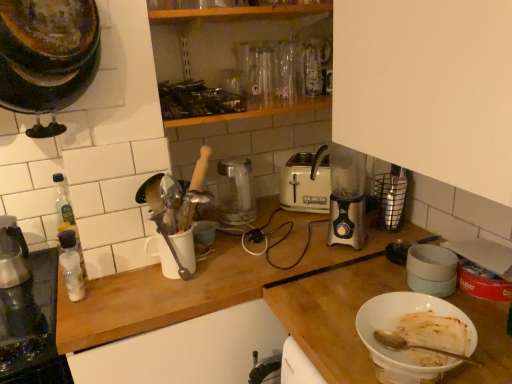
Locate an element on the screen. free space in front of silver metallic blender at center, which appears as the 1th kitchen appliance when viewed from the right is located at coordinates (330, 252).